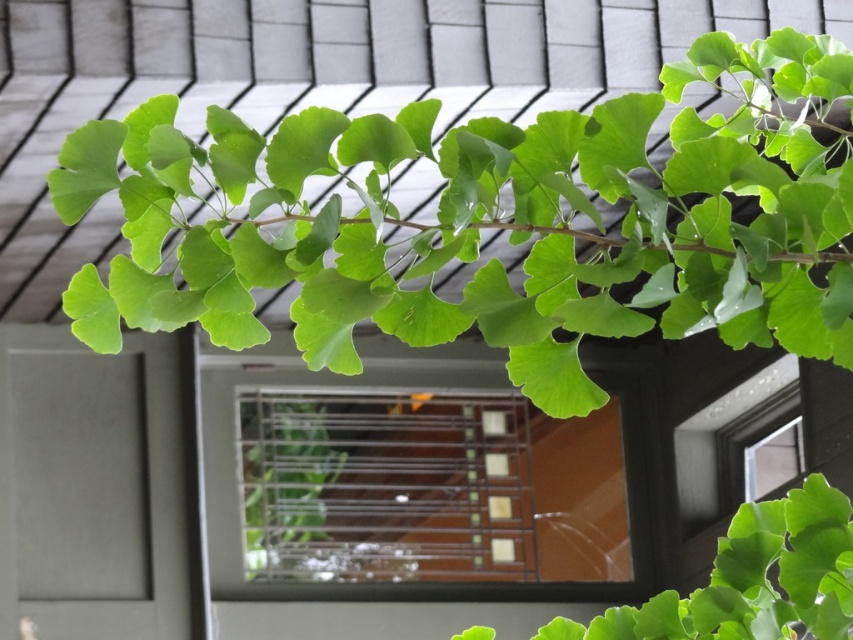
Can you confirm if clear glass window at center is taller than green matte leaf at center?

Indeed, clear glass window at center has a greater height compared to green matte leaf at center.

Measure the distance between clear glass window at center and camera.

They are 7.99 meters apart.

Which is in front, point (370, 444) or point (473, 628)?

Point (473, 628)

The width and height of the screenshot is (853, 640). In order to click on clear glass window at center in this screenshot , I will do `click(410, 481)`.

What do you see at coordinates (492, 221) in the screenshot? I see `green matte leafy branch at upper center` at bounding box center [492, 221].

Is green matte leafy branch at upper center smaller than clear glass window at center?

Yes, green matte leafy branch at upper center is smaller than clear glass window at center.

This screenshot has width=853, height=640. In order to click on green matte leafy branch at upper center in this screenshot , I will do `click(492, 221)`.

The image size is (853, 640). Find the location of `green matte leafy branch at upper center`. green matte leafy branch at upper center is located at coordinates (492, 221).

Which is in front, point (186, 230) or point (846, 500)?

Point (186, 230) is more forward.

Measure the distance between green matte leafy branch at upper center and green matte leaf at center.

32.83 centimeters

Where is `green matte leafy branch at upper center`? green matte leafy branch at upper center is located at coordinates (492, 221).